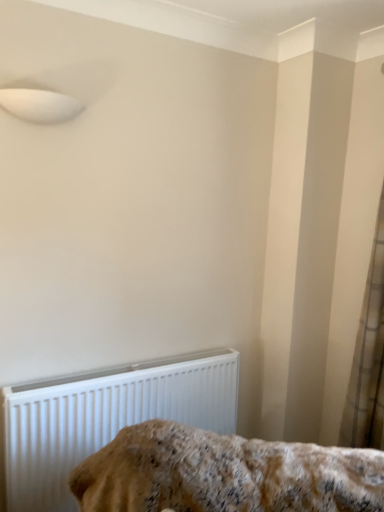
Question: Considering the relative sizes of white plastic radiator at lower left and white sheer curtain at right in the image provided, is white plastic radiator at lower left smaller than white sheer curtain at right?

Choices:
 (A) yes
 (B) no

Answer: (B)

Question: Considering the relative positions of white plastic radiator at lower left and white sheer curtain at right in the image provided, is white plastic radiator at lower left to the left of white sheer curtain at right from the viewer's perspective?

Choices:
 (A) no
 (B) yes

Answer: (B)

Question: Is white sheer curtain at right located within white plastic radiator at lower left?

Choices:
 (A) no
 (B) yes

Answer: (A)

Question: Is white plastic radiator at lower left bigger than white sheer curtain at right?

Choices:
 (A) no
 (B) yes

Answer: (B)

Question: Can you confirm if white plastic radiator at lower left is thinner than white sheer curtain at right?

Choices:
 (A) yes
 (B) no

Answer: (A)

Question: Is white plastic radiator at lower left beside white sheer curtain at right?

Choices:
 (A) no
 (B) yes

Answer: (A)

Question: Does fluffy beige blanket at lower center have a lesser height compared to white plastic radiator at lower left?

Choices:
 (A) no
 (B) yes

Answer: (B)

Question: Is fluffy beige blanket at lower center oriented towards white plastic radiator at lower left?

Choices:
 (A) no
 (B) yes

Answer: (A)

Question: Considering the relative positions of fluffy beige blanket at lower center and white plastic radiator at lower left in the image provided, is fluffy beige blanket at lower center to the left of white plastic radiator at lower left from the viewer's perspective?

Choices:
 (A) yes
 (B) no

Answer: (B)

Question: Is fluffy beige blanket at lower center with white plastic radiator at lower left?

Choices:
 (A) yes
 (B) no

Answer: (B)

Question: From a real-world perspective, is fluffy beige blanket at lower center below white plastic radiator at lower left?

Choices:
 (A) yes
 (B) no

Answer: (B)

Question: Can you confirm if fluffy beige blanket at lower center is smaller than white plastic radiator at lower left?

Choices:
 (A) no
 (B) yes

Answer: (A)

Question: Is white sheer curtain at right to the left of fluffy beige blanket at lower center from the viewer's perspective?

Choices:
 (A) no
 (B) yes

Answer: (A)